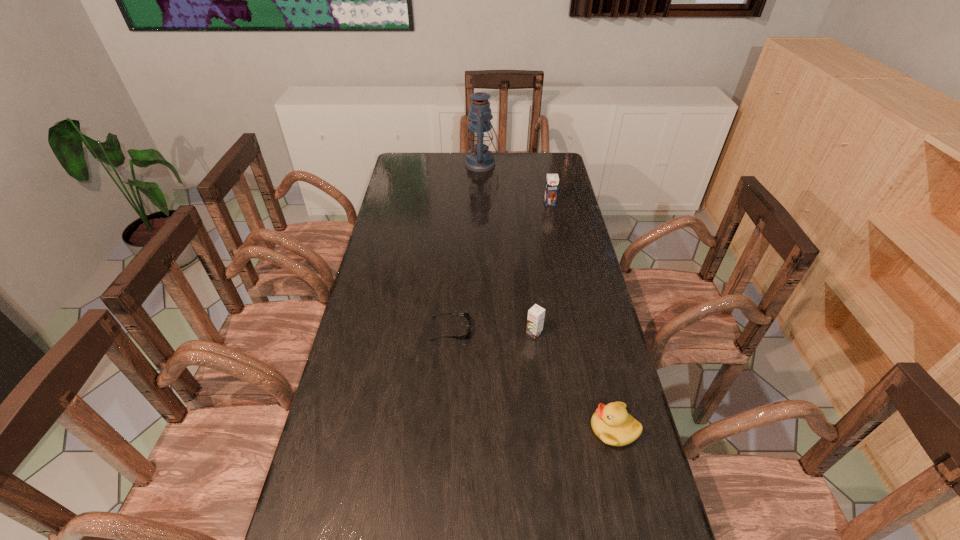
In order to click on duckling that is positioned at the right edge in this screenshot , I will do `click(611, 423)`.

In the image, there is a desktop. Identify the location of vacant space at the far edge. (492, 177).

The width and height of the screenshot is (960, 540). I want to click on free space at the left edge of the desktop, so click(414, 266).

Locate an element on the screen. Image resolution: width=960 pixels, height=540 pixels. vacant space at the right edge of the desktop is located at coordinates (586, 477).

I want to click on vacant space at the far left corner of the desktop, so click(x=410, y=160).

The image size is (960, 540). Find the location of `vacant area between the second shortest object and the nearer chocolate milk`. vacant area between the second shortest object and the nearer chocolate milk is located at coordinates (574, 381).

This screenshot has width=960, height=540. I want to click on empty space that is in between the second tallest object and the sunglasses, so click(500, 266).

This screenshot has width=960, height=540. I want to click on empty location between the left chocolate milk and the duckling, so click(574, 381).

Find the location of a particular element. This screenshot has height=540, width=960. vacant area that lies between the third object from right to left and the shortest object is located at coordinates (492, 331).

Image resolution: width=960 pixels, height=540 pixels. Identify the location of free space between the tallest object and the second tallest object. (516, 184).